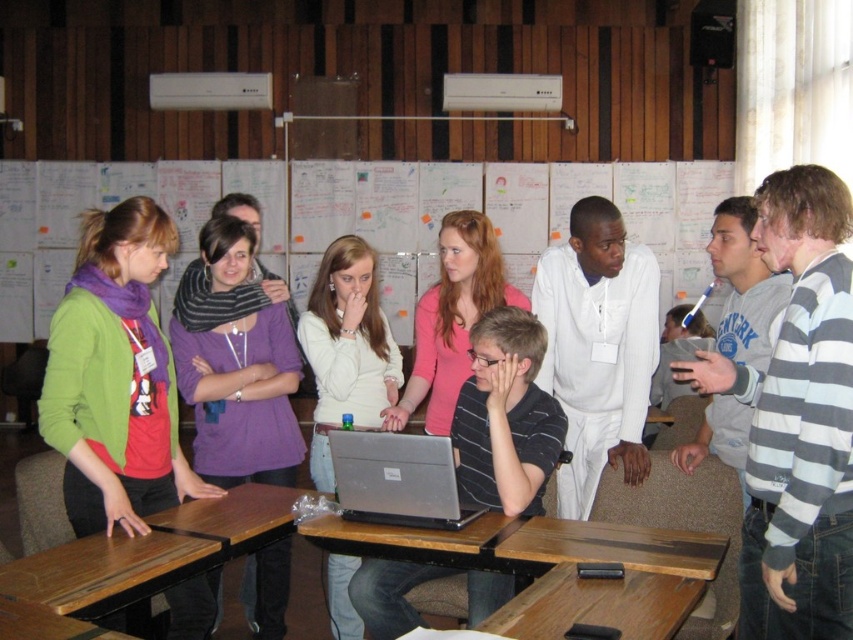
Question: Which object is positioned farthest from the brown wooden table at lower left?

Choices:
 (A) pink matte shirt at center
 (B) gray striped sweater at right
 (C) wooden table at center
 (D) silver metallic laptop at center

Answer: (B)

Question: Does pink matte shirt at center lie behind silver metallic laptop at center?

Choices:
 (A) no
 (B) yes

Answer: (B)

Question: Where is gray striped sweater at right located in relation to white matte shirt at center in the image?

Choices:
 (A) left
 (B) right

Answer: (B)

Question: Which object is the closest to the gray striped sweater at right?

Choices:
 (A) brown wooden table at lower left
 (B) pink matte shirt at center

Answer: (B)

Question: Is wooden table at lower left above silver metallic laptop at center?

Choices:
 (A) yes
 (B) no

Answer: (B)

Question: Among these objects, which one is nearest to the camera?

Choices:
 (A) brown wooden table at lower left
 (B) white paperboard at center
 (C) purple soft scarf at center
 (D) wooden table at center

Answer: (A)